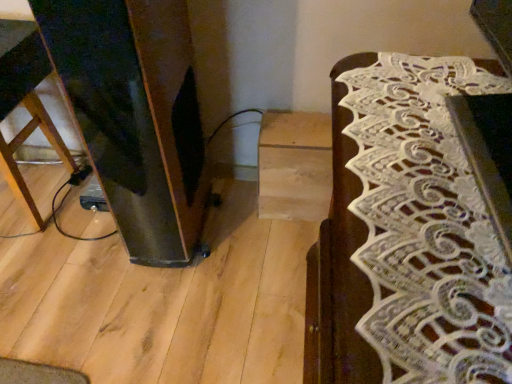
Image resolution: width=512 pixels, height=384 pixels. In order to click on unoccupied region to the right of wooden stool at left, which appears as the second furniture when viewed from the front in this screenshot , I will do `click(79, 215)`.